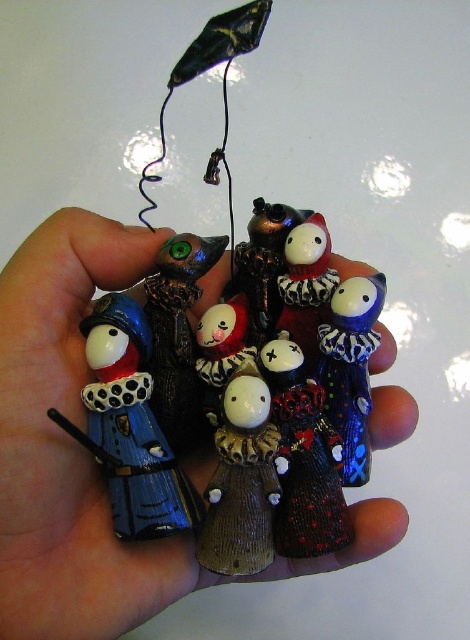
You are holding two clowns in your hand, the blue glossy clown at center and the porcelain clown at center. Which one is closer to your palm?

The blue glossy clown at center is closer to the viewer than the porcelain clown at center, so it is closer to your palm.

You are a photographer trying to capture a closeup shot of the matte black raven at center. The camera requires the subject to be exactly 36 inches away for optimal focus. Is the current distance sufficient?

The matte black raven at center is 35.96 inches away from the camera, which is just slightly less than the required 36 inches. This distance should still allow for a sharp closeup, as minor adjustments can be made to meet the focus requirement.

You are a collector examining the figurines displayed in the scene. You notice a specific point in the image at coordinates point (91, 456). What object is located at that point?

The point (91, 456) is where the matte ceramic figurines at center are located.